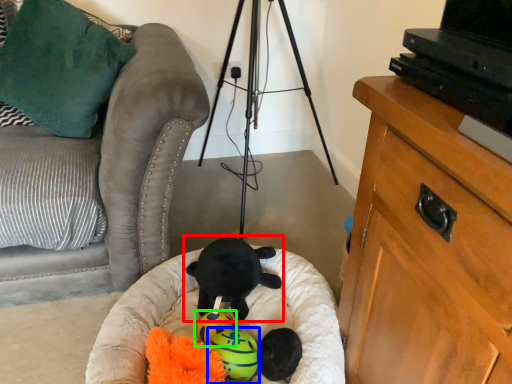
Question: Considering the real-world distances, which object is farthest from toy (highlighted by a red box)? toy (highlighted by a blue box) or toy (highlighted by a green box)?

Choices:
 (A) toy
 (B) toy

Answer: (A)